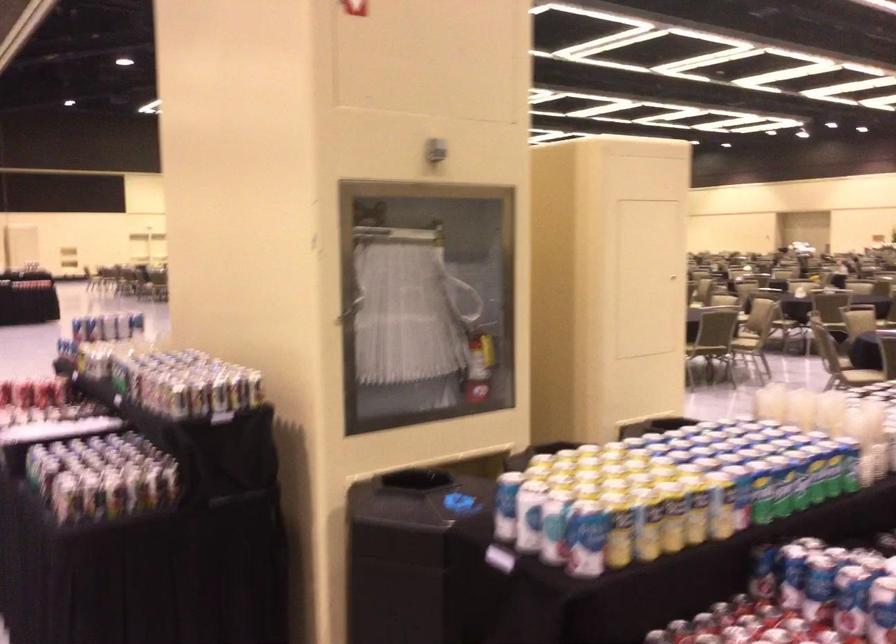
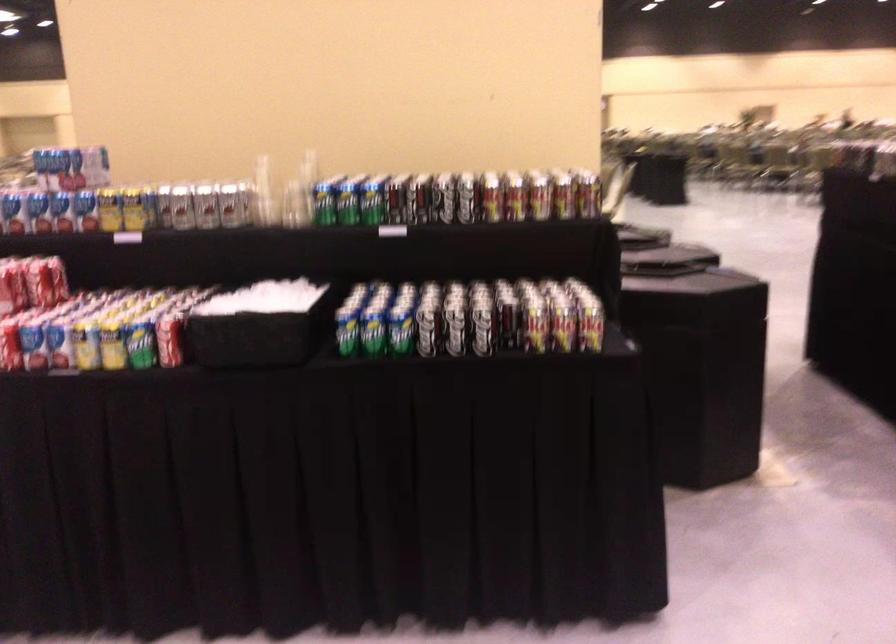
Where in the second image is the point corresponding to point (104, 345) from the first image?

(182, 207)